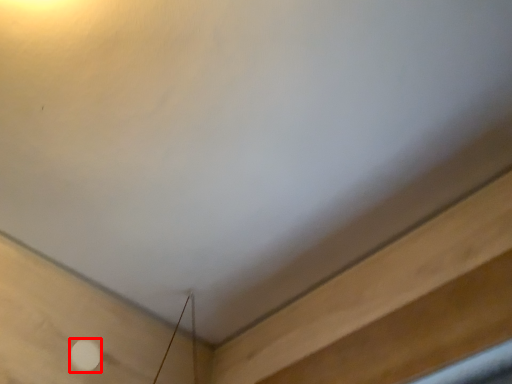
Question: From the image, what is the correct spatial relationship of dot (annotated by the red box) in relation to plywood?

Choices:
 (A) right
 (B) left

Answer: (B)